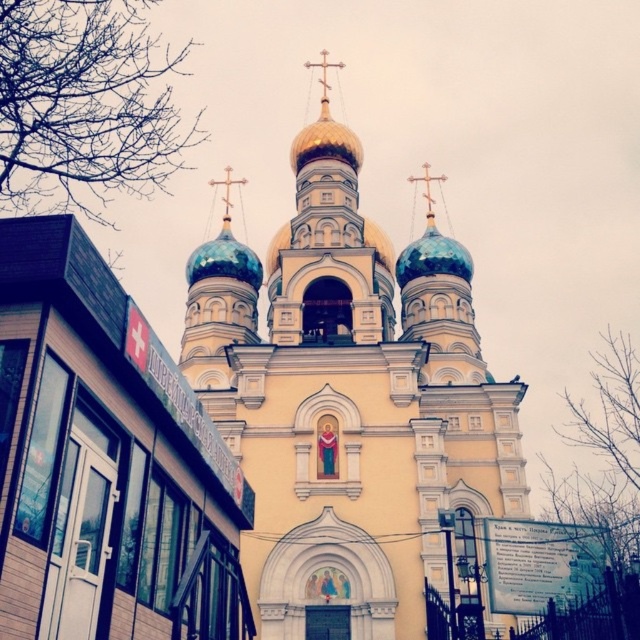
Question: Can you confirm if blue glossy dome at center is positioned to the left of blue glossy dome at upper center?

Choices:
 (A) no
 (B) yes

Answer: (B)

Question: Considering the real-world distances, which object is farthest from the yellow stone church at center?

Choices:
 (A) blue glossy dome at center
 (B) blue glossy dome at upper center

Answer: (A)

Question: Which is farther from the blue glossy dome at center?

Choices:
 (A) yellow stone church at center
 (B) blue glossy dome at upper center

Answer: (B)

Question: Which of the following is the farthest from the observer?

Choices:
 (A) (193, 256)
 (B) (461, 262)
 (C) (333, 419)

Answer: (A)

Question: Does blue glossy dome at center have a smaller size compared to blue glossy dome at upper center?

Choices:
 (A) yes
 (B) no

Answer: (B)

Question: Is the position of yellow stone church at center more distant than that of blue glossy dome at upper center?

Choices:
 (A) yes
 (B) no

Answer: (B)